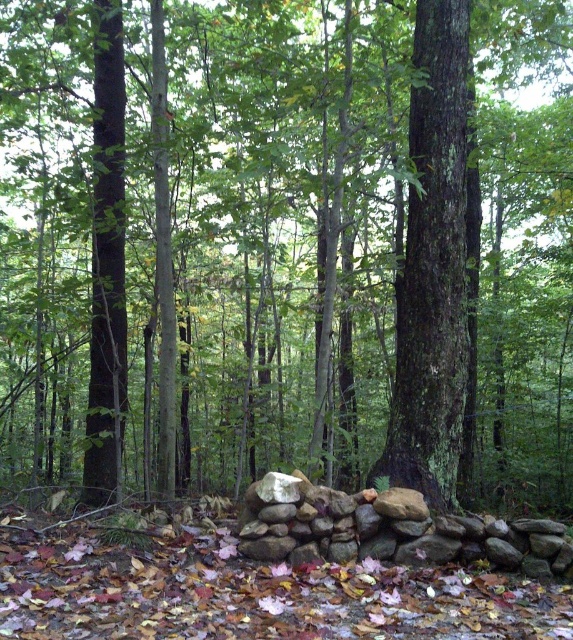
You are a hiker standing in the forest and want to take a photo of the smooth bark tree at center and the brown rough stone wall at center. Which object should you focus on first to ensure both are in the frame?

You should focus on the brown rough stone wall at center first because it is closer to you than the smooth bark tree at center, allowing you to adjust the framing to include both.

You are standing in the forest scene and want to place a small flag at both point (429, 269) and point (348, 552). Which point is closer to you?

Point (348, 552) is closer to you because it is less further to the camera than point (429, 269).

You are planning to place a large sculpture that requires a base of at least 3 meters in diameter. Based on the scene, which object between the smooth bark tree at center and the brown rough stone wall at center would be more suitable as a base for the sculpture?

The smooth bark tree at center is bigger than the brown rough stone wall at center, so it would be more suitable as a base for the sculpture since it can accommodate the required diameter.